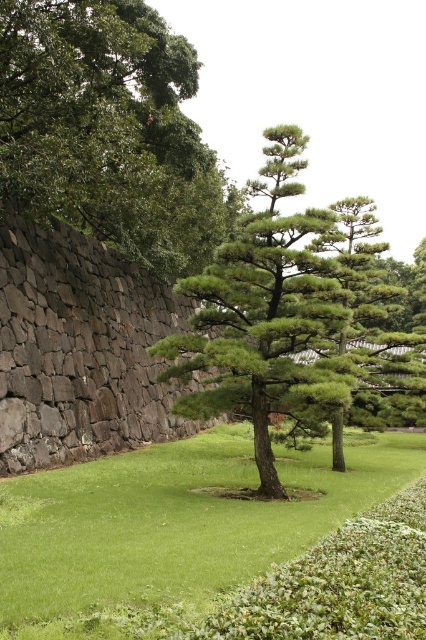
You are a gardener planning to plant a new flower bed between the green grass at center and the green leafy tree at upper left. Based on their positions, where should you place the flower bed?

The green grass at center is below the green leafy tree at upper left, so the flower bed should be placed between them, positioning it under the tree but above the existing grass area to maintain spatial harmony.